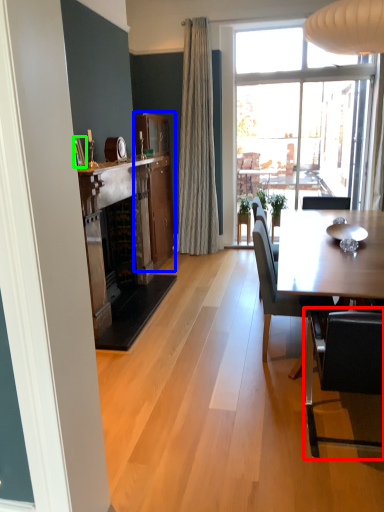
Question: Which object is the closest to the chair (highlighted by a red box)? Choose among these: cabinetry (highlighted by a blue box) or picture frame (highlighted by a green box).

Choices:
 (A) cabinetry
 (B) picture frame

Answer: (B)